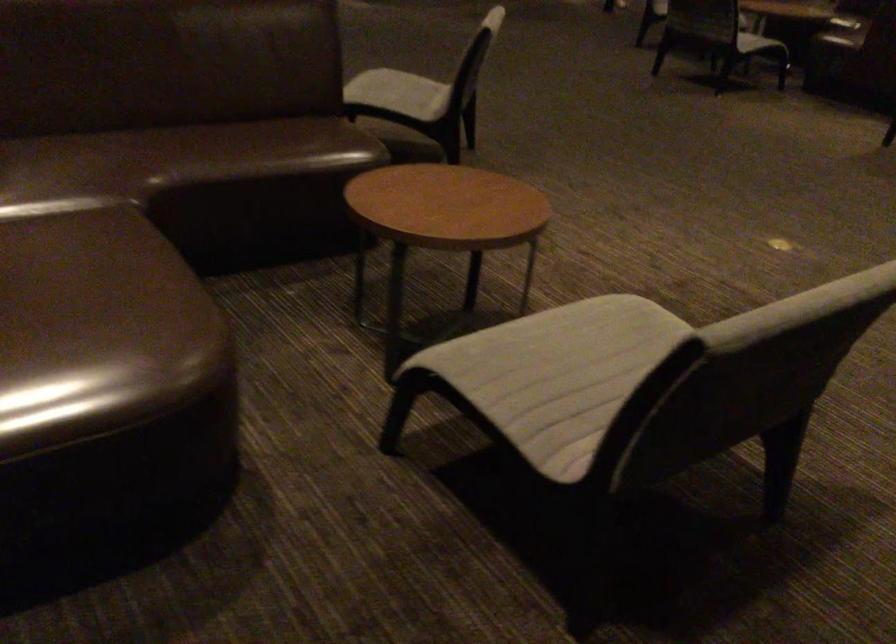
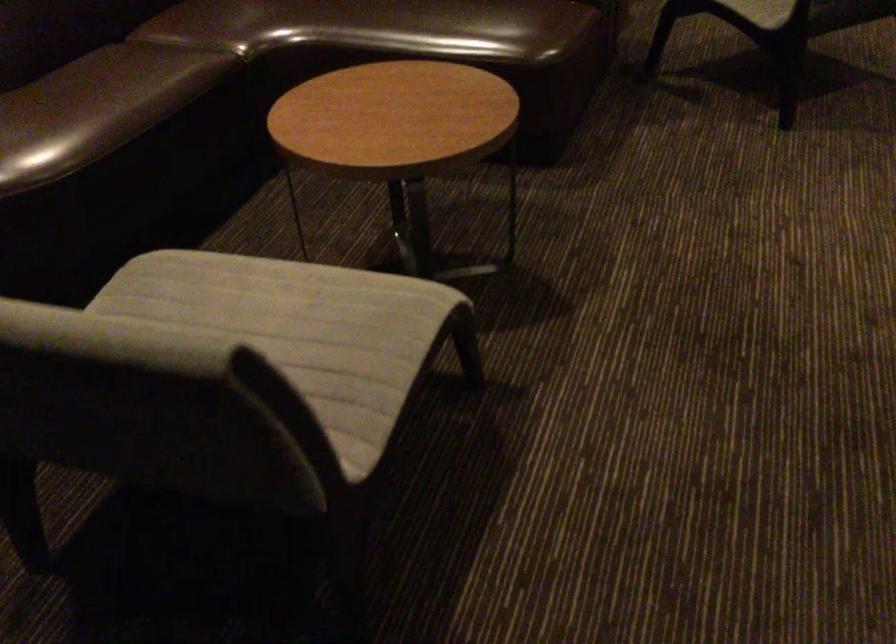
Find the pixel in the second image that matches point 573,337 in the first image.

(280, 299)